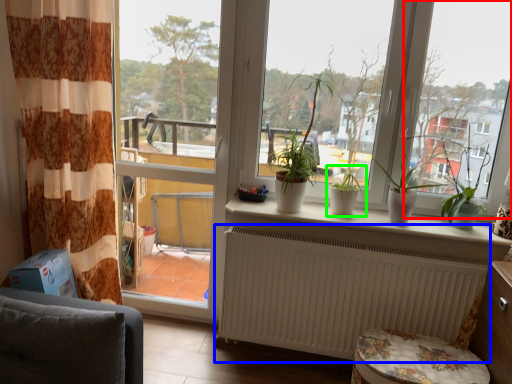
Question: Estimate the real-world distances between objects in this image. Which object is farther from window screen (highlighted by a red box), radiator (highlighted by a blue box) or houseplant (highlighted by a green box)?

Choices:
 (A) radiator
 (B) houseplant

Answer: (A)